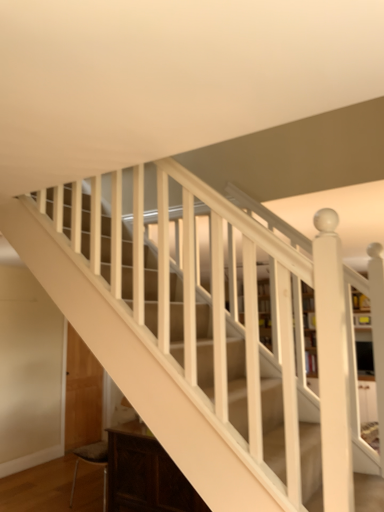
Question: Looking at their shapes, would you say dark wood cabinet at lower left is wider or thinner than wooden bookcase at center?

Choices:
 (A) wide
 (B) thin

Answer: (A)

Question: In the image, is dark wood cabinet at lower left on the left side or the right side of wooden bookcase at center?

Choices:
 (A) left
 (B) right

Answer: (A)

Question: Relative to wooden bookcase at center, is dark wood cabinet at lower left in front or behind?

Choices:
 (A) behind
 (B) front

Answer: (B)

Question: From a real-world perspective, is wooden bookcase at center physically located above or below dark wood cabinet at lower left?

Choices:
 (A) above
 (B) below

Answer: (A)

Question: From the image's perspective, relative to dark wood cabinet at lower left, is wooden bookcase at center above or below?

Choices:
 (A) above
 (B) below

Answer: (A)

Question: Considering the positions of wooden bookcase at center and dark wood cabinet at lower left in the image, is wooden bookcase at center bigger or smaller than dark wood cabinet at lower left?

Choices:
 (A) big
 (B) small

Answer: (A)

Question: Looking at their shapes, would you say wooden bookcase at center is wider or thinner than dark wood cabinet at lower left?

Choices:
 (A) thin
 (B) wide

Answer: (A)